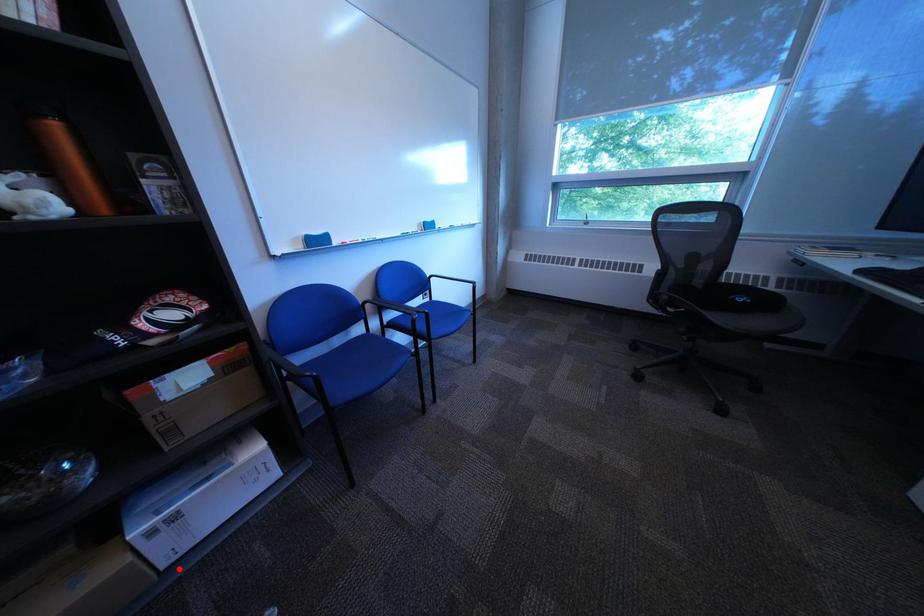
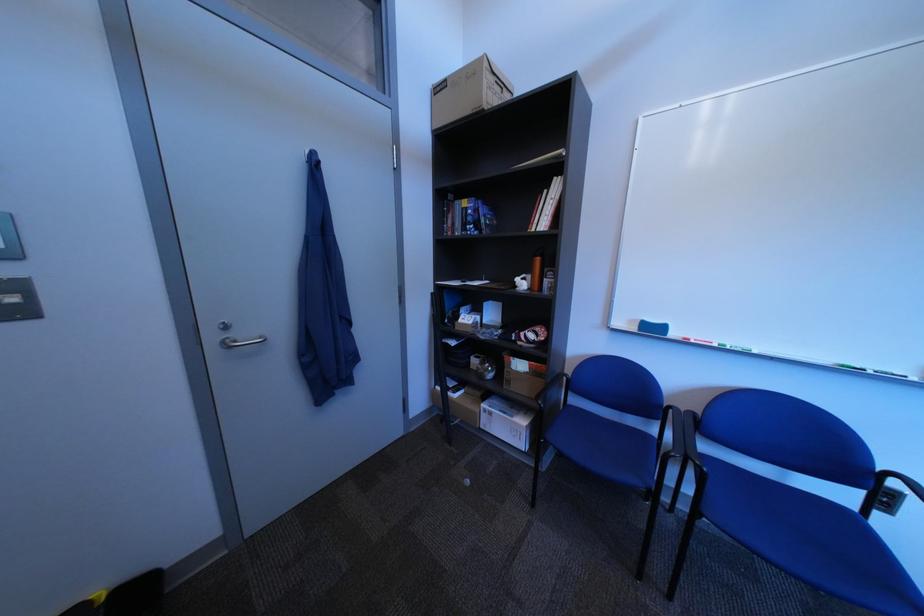
Question: I am providing you with two images of the same scene from different viewpoints. Image1 has a red point marked. In image2, the corresponding 3D location appears at what relative position? Reply with the corresponding letter.

Choices:
 (A) Closer
 (B) Farther

Answer: (B)